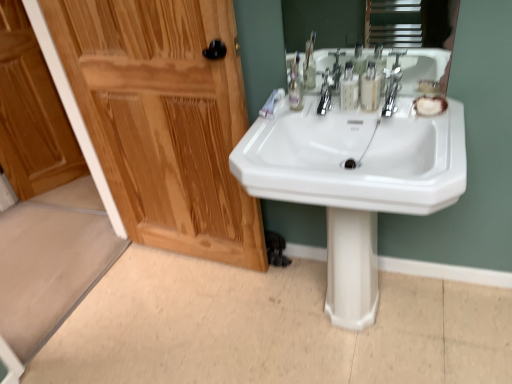
Where is `free space on the front side of white glossy pedestal at center`? free space on the front side of white glossy pedestal at center is located at coordinates (370, 350).